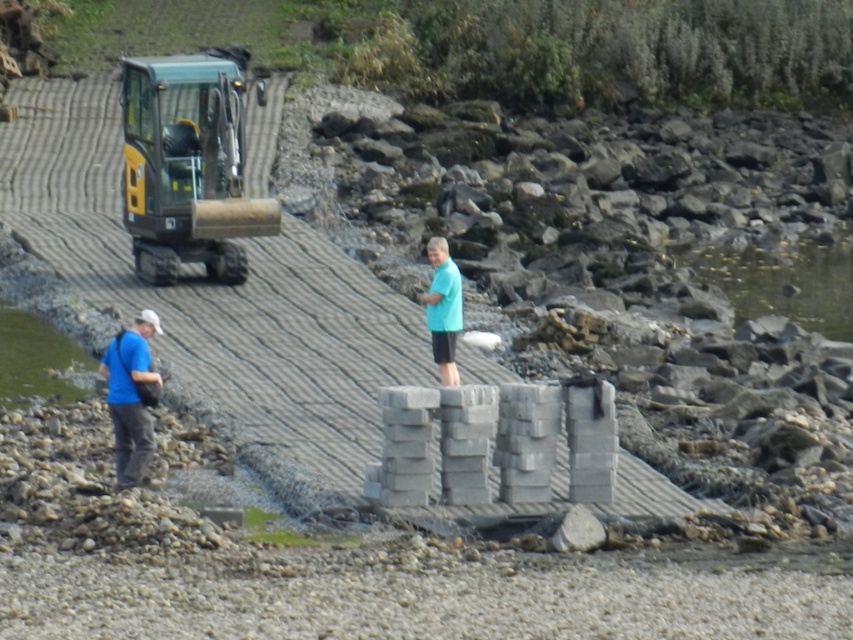
You are a surveyor standing at the base of the walkway and need to locate two points marked on the walkway. The first point is at coordinates point (227, 64) and the second is at point (146, 353). Which point is closer to you?

Point (146, 353) is closer to you because it is in front of point (227, 64).